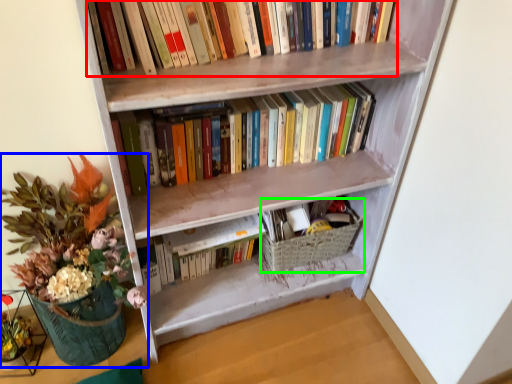
Question: Considering the real-world distances, which object is closest to book (highlighted by a red box)? houseplant (highlighted by a blue box) or basket (highlighted by a green box).

Choices:
 (A) houseplant
 (B) basket

Answer: (A)